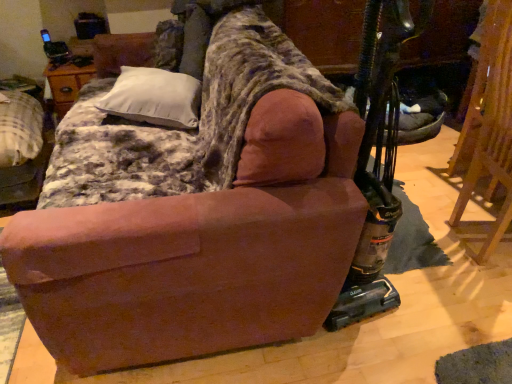
Question: Can you confirm if wooden folding chair at right is bigger than white soft pillow at upper left?

Choices:
 (A) yes
 (B) no

Answer: (A)

Question: Is wooden folding chair at right outside of white soft pillow at upper left?

Choices:
 (A) yes
 (B) no

Answer: (A)

Question: Is wooden folding chair at right facing towards white soft pillow at upper left?

Choices:
 (A) yes
 (B) no

Answer: (B)

Question: Is wooden folding chair at right in contact with white soft pillow at upper left?

Choices:
 (A) yes
 (B) no

Answer: (B)

Question: Would you say wooden folding chair at right contains white soft pillow at upper left?

Choices:
 (A) yes
 (B) no

Answer: (B)

Question: From the image's perspective, is wooden folding chair at right under white soft pillow at upper left?

Choices:
 (A) yes
 (B) no

Answer: (A)

Question: Is velvet-like brown armchair at center-left facing towards wooden folding chair at right?

Choices:
 (A) no
 (B) yes

Answer: (A)

Question: Is velvet-like brown armchair at center-left in contact with wooden folding chair at right?

Choices:
 (A) no
 (B) yes

Answer: (A)

Question: Is velvet-like brown armchair at center-left positioned far away from wooden folding chair at right?

Choices:
 (A) yes
 (B) no

Answer: (A)

Question: From a real-world perspective, is velvet-like brown armchair at center-left on wooden folding chair at right?

Choices:
 (A) yes
 (B) no

Answer: (B)

Question: Considering the relative sizes of velvet-like brown armchair at center-left and wooden folding chair at right in the image provided, is velvet-like brown armchair at center-left taller than wooden folding chair at right?

Choices:
 (A) yes
 (B) no

Answer: (B)

Question: Is wooden folding chair at right located within velvet-like brown armchair at center-left?

Choices:
 (A) no
 (B) yes

Answer: (A)

Question: Considering the relative sizes of velvet-like brown armchair at center-left and white soft pillow at upper left in the image provided, is velvet-like brown armchair at center-left taller than white soft pillow at upper left?

Choices:
 (A) yes
 (B) no

Answer: (A)